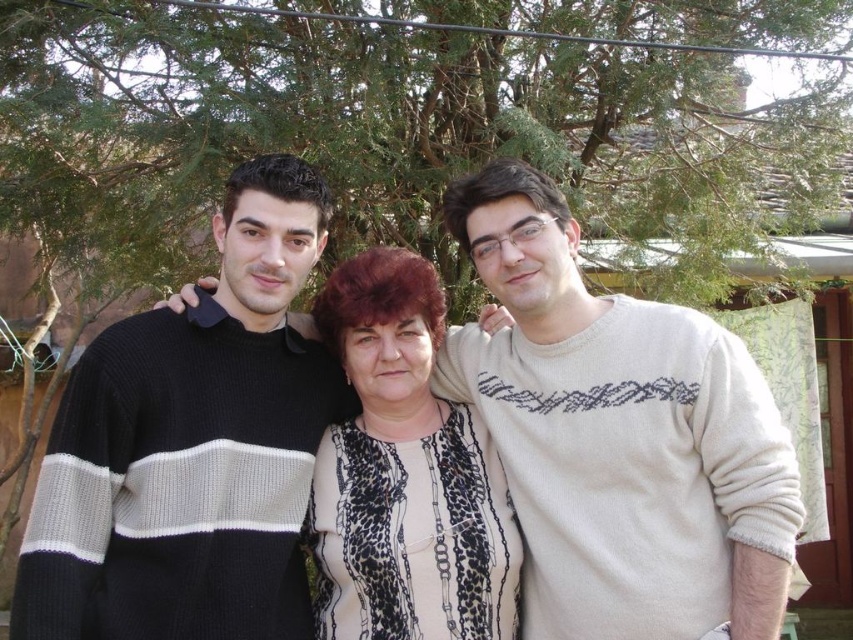
Does black knitted sweater at left come in front of leopard print blouse at center?

Yes.

Which of these two, black knitted sweater at left or leopard print blouse at center, stands shorter?

leopard print blouse at center

Which is behind, point (209, 460) or point (398, 588)?

The point (398, 588) is behind.

Identify the location of black knitted sweater at left. Image resolution: width=853 pixels, height=640 pixels. (192, 445).

Which is behind, point (593, 612) or point (90, 490)?

Point (593, 612)

Is black knit sweater at center shorter than black knitted sweater at left?

Correct, black knit sweater at center is not as tall as black knitted sweater at left.

Locate an element on the screen. black knit sweater at center is located at coordinates (618, 435).

Where is `black knit sweater at center`? Image resolution: width=853 pixels, height=640 pixels. black knit sweater at center is located at coordinates (618, 435).

Can you confirm if black knit sweater at center is thinner than leopard print blouse at center?

In fact, black knit sweater at center might be wider than leopard print blouse at center.

Does black knit sweater at center lie in front of leopard print blouse at center?

Yes, it is in front of leopard print blouse at center.

Identify the location of black knit sweater at center. The height and width of the screenshot is (640, 853). (618, 435).